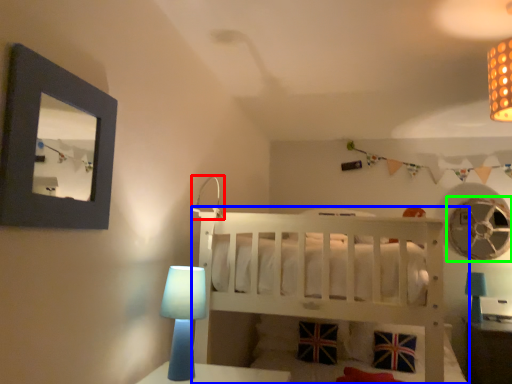
Question: Which object is positioned farthest from lamp (highlighted by a red box)? Select from infant bed (highlighted by a blue box) and mechanical fan (highlighted by a green box).

Choices:
 (A) infant bed
 (B) mechanical fan

Answer: (B)